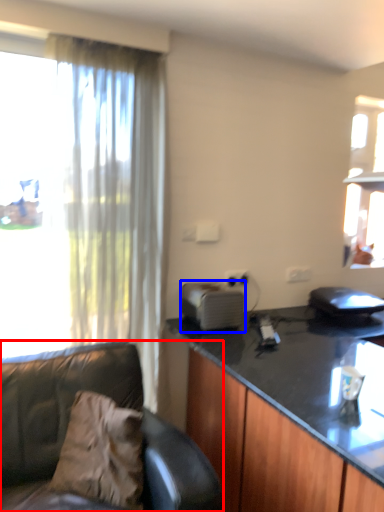
Question: Which object appears closest to the camera in this image, studio couch (highlighted by a red box) or appliance (highlighted by a blue box)?

Choices:
 (A) studio couch
 (B) appliance

Answer: (A)